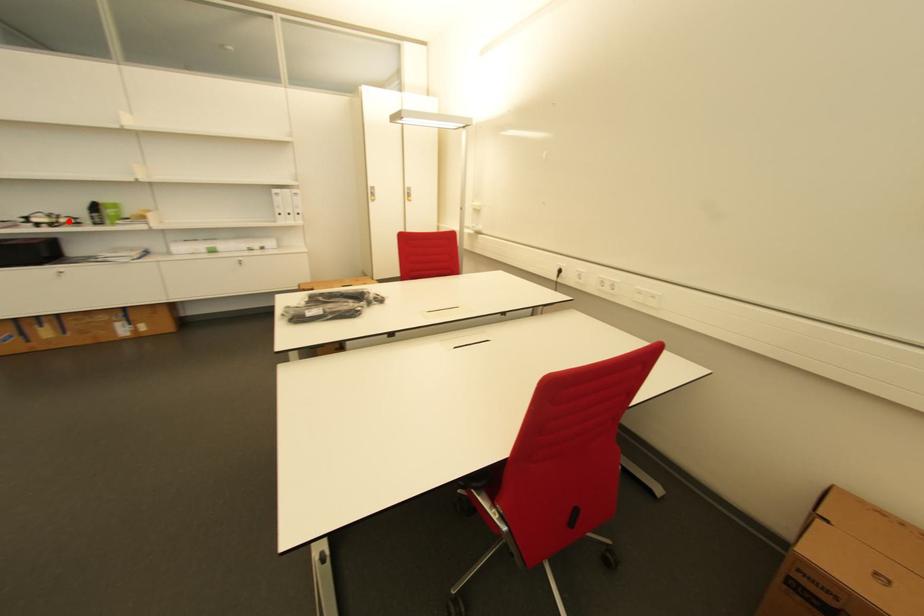
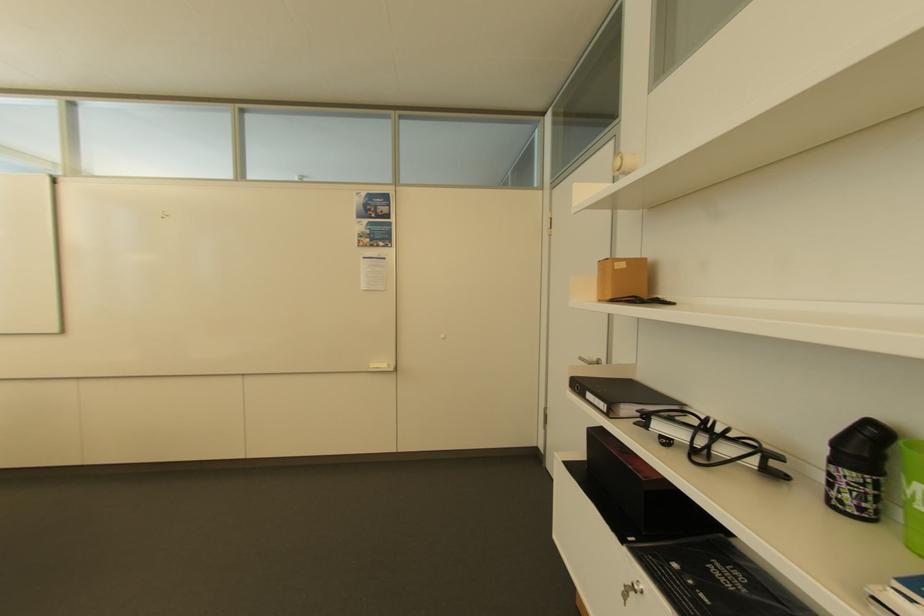
Question: A red point is marked in image1. In image2, is the corresponding 3D point closer to the camera or farther? Reply with the corresponding letter.

Choices:
 (A) The corresponding 3D point is closer.
 (B) The corresponding 3D point is farther.

Answer: (A)